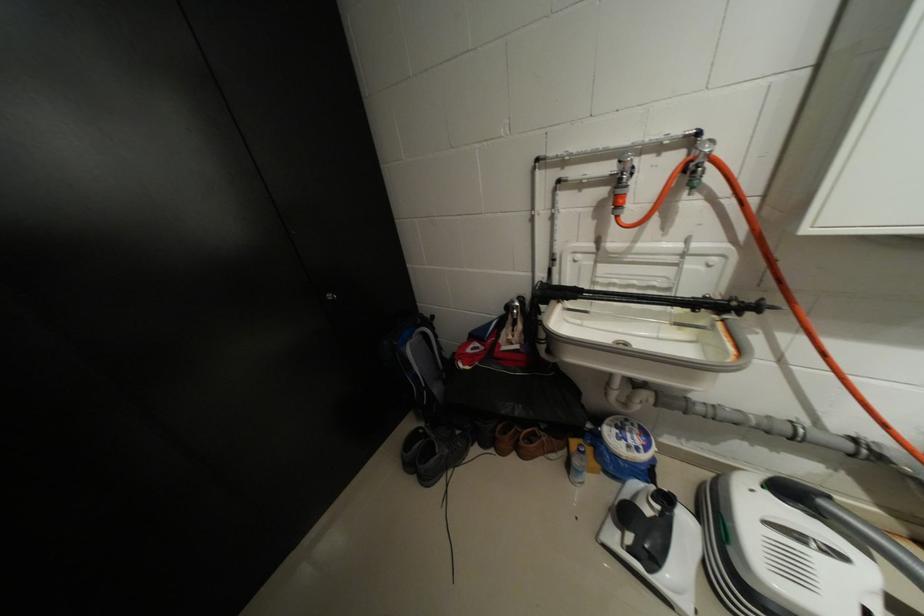
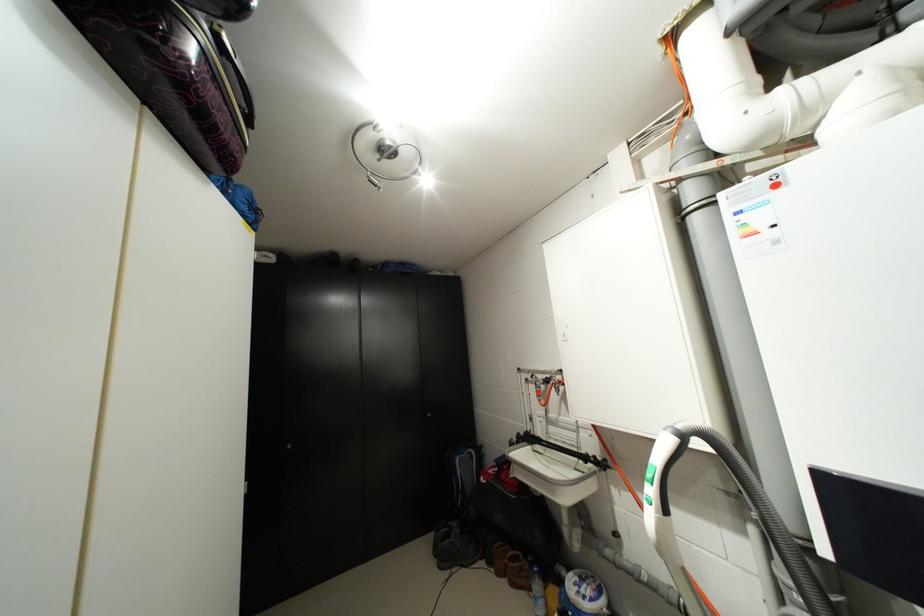
Where in the second image is the point corresponding to (x=508, y=453) from the first image?

(505, 575)